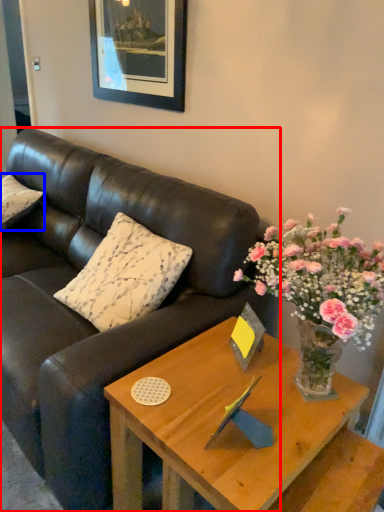
Question: Which object appears farthest to the camera in this image, studio couch (highlighted by a red box) or pillow (highlighted by a blue box)?

Choices:
 (A) studio couch
 (B) pillow

Answer: (B)